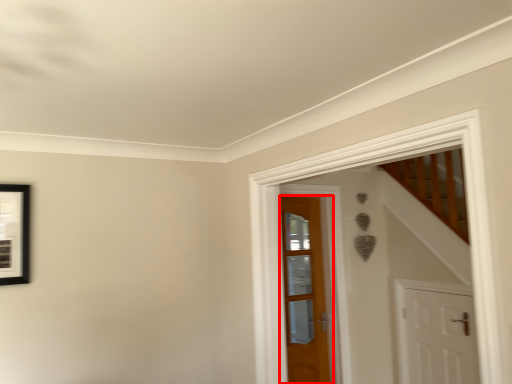
Question: Where is door (annotated by the red box) located in relation to door in the image?

Choices:
 (A) left
 (B) right

Answer: (A)